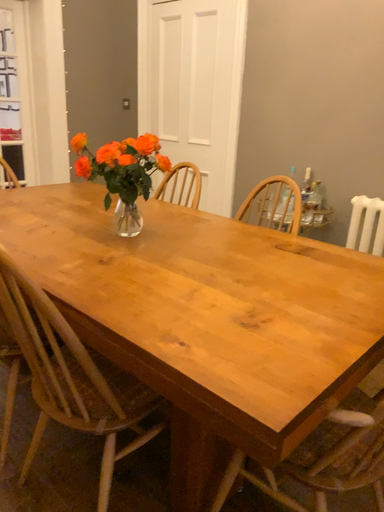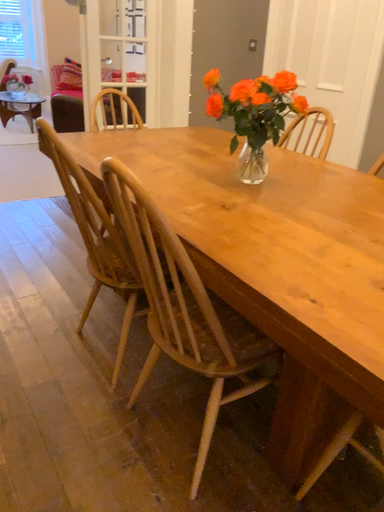
Question: Which way did the camera rotate in the video?

Choices:
 (A) rotated left
 (B) rotated right

Answer: (A)